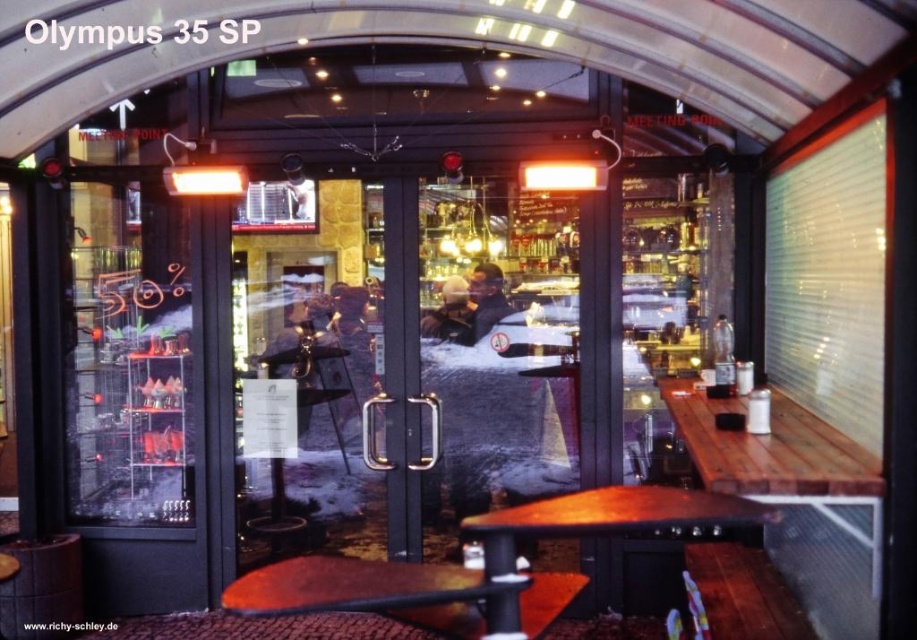
Question: Is brown wooden table at center behind wooden table at center?

Choices:
 (A) no
 (B) yes

Answer: (A)

Question: Which of the following is the closest to the observer?

Choices:
 (A) (857, 512)
 (B) (407, 620)

Answer: (B)

Question: In this image, where is wooden table at right located relative to wooden table at center?

Choices:
 (A) below
 (B) above

Answer: (A)

Question: Which of the following is the farthest from the observer?

Choices:
 (A) (389, 563)
 (B) (820, 461)

Answer: (A)

Question: Is wooden table at right to the right of brown wooden table at center from the viewer's perspective?

Choices:
 (A) yes
 (B) no

Answer: (A)

Question: Which point is farther to the camera?

Choices:
 (A) coord(706,486)
 (B) coord(238,577)

Answer: (B)